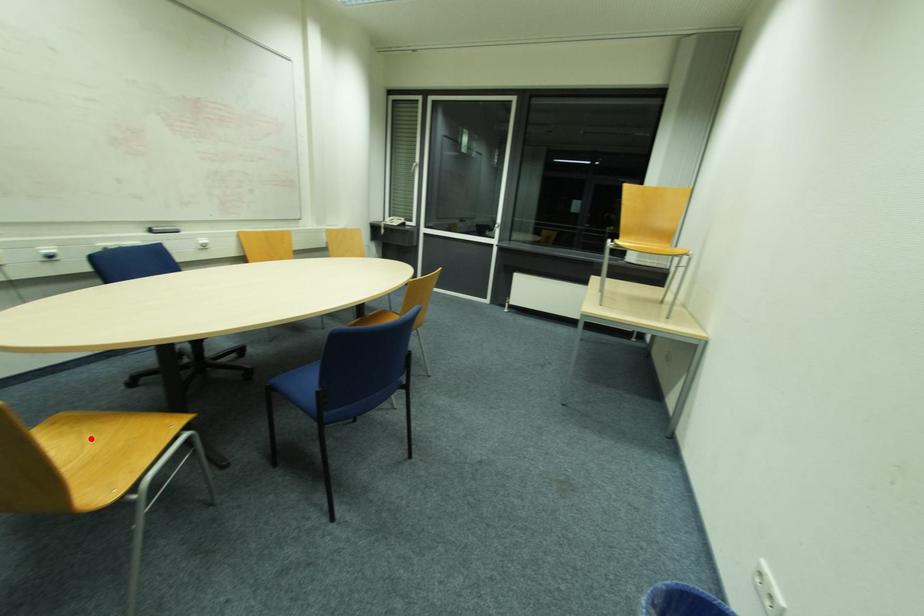
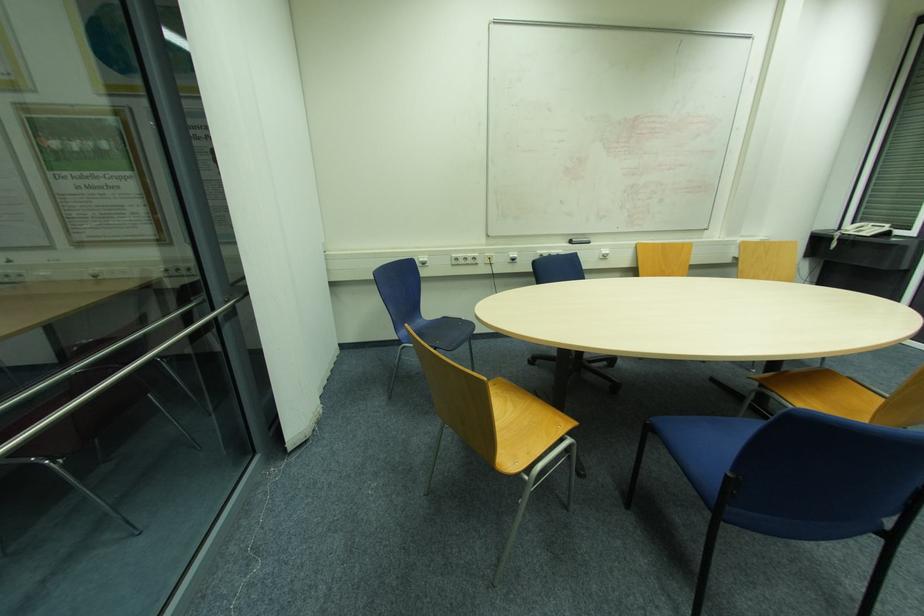
Question: I am providing you with two images of the same scene from different viewpoints. Image1 has a red point marked. In image2, the corresponding 3D location appears at what relative position? Reply with the corresponding letter.

Choices:
 (A) Closer
 (B) Farther

Answer: (A)